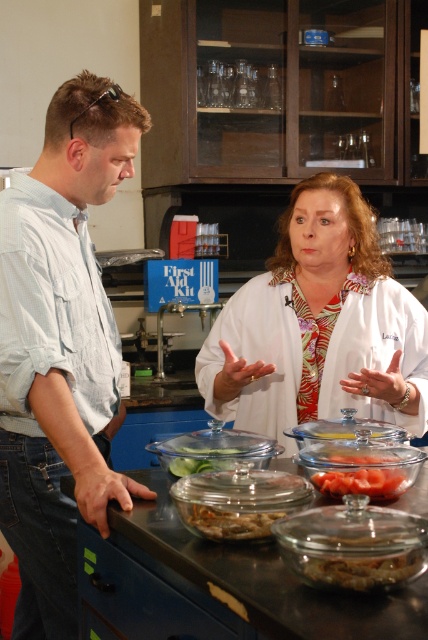
This screenshot has width=428, height=640. I want to click on light blue denim shirt at left, so click(x=61, y=348).

Between light blue denim shirt at left and white glossy lab coat at center, which one is positioned higher?

white glossy lab coat at center is above.

Which is in front, point (56, 156) or point (371, 244)?

Positioned in front is point (56, 156).

I want to click on light blue denim shirt at left, so click(61, 348).

Does light blue denim shirt at left appear over clear plastic container at center?

Correct, light blue denim shirt at left is located above clear plastic container at center.

Which of these two, light blue denim shirt at left or clear plastic container at center, stands taller?

light blue denim shirt at left is taller.

Is point (95, 477) farther from viewer compared to point (214, 465)?

No.

Locate an element on the screen. light blue denim shirt at left is located at coordinates (61, 348).

Between black granite counter at center and brown matte food at center, which one has less height?

Standing shorter between the two is brown matte food at center.

Looking at this image, can you confirm if black granite counter at center is positioned to the left of brown matte food at center?

No, black granite counter at center is not to the left of brown matte food at center.

Between point (133, 544) and point (183, 515), which one is positioned behind?

The point (133, 544) is behind.

Where is `black granite counter at center`? The height and width of the screenshot is (640, 428). black granite counter at center is located at coordinates (216, 586).